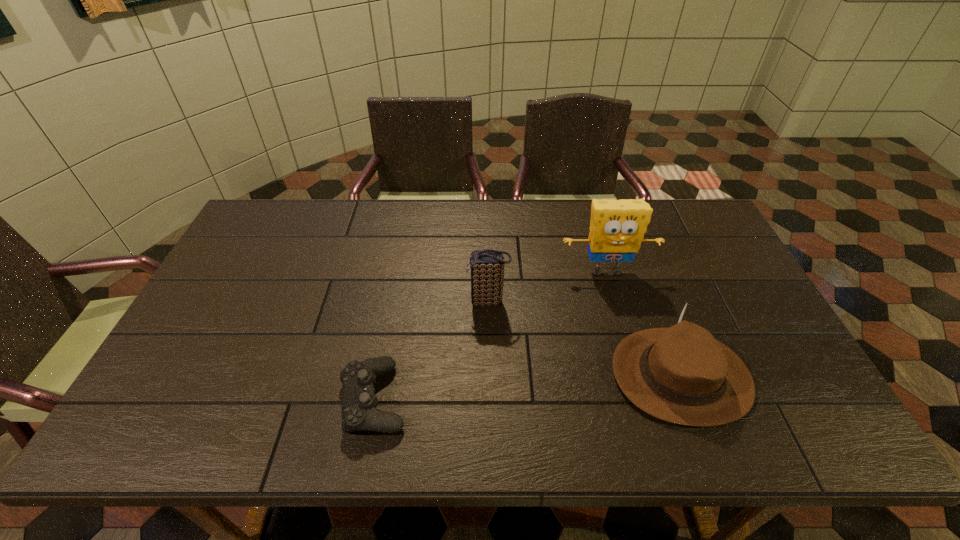
Image resolution: width=960 pixels, height=540 pixels. I want to click on the farthest object, so click(x=617, y=227).

Where is `sponge`? The image size is (960, 540). sponge is located at coordinates (617, 227).

Where is `the third object from right to left`? This screenshot has width=960, height=540. the third object from right to left is located at coordinates (487, 266).

Where is `clutch bag`? The width and height of the screenshot is (960, 540). clutch bag is located at coordinates (487, 266).

The height and width of the screenshot is (540, 960). I want to click on fedora, so click(x=681, y=374).

Locate an element on the screen. the leftmost object is located at coordinates (359, 401).

Image resolution: width=960 pixels, height=540 pixels. What are the coordinates of `control` in the screenshot? It's located at (359, 401).

The height and width of the screenshot is (540, 960). In order to click on vacant space situated on the face of the sponge in this screenshot , I will do `click(626, 340)`.

The width and height of the screenshot is (960, 540). In order to click on vacant space located 0.070m with the zip open on the clutch bag in this screenshot , I will do `click(443, 302)`.

This screenshot has width=960, height=540. Identify the location of vacant space located 0.180m with the zip open on the clutch bag. (404, 302).